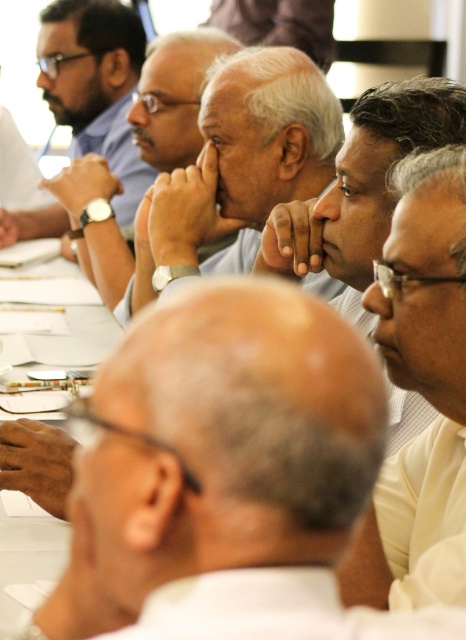
You are standing in front of the table where the meeting is taking place. You notice two points marked on the table surface at coordinates point (207, 301) and point (175, 157). Which point is closer to you?

Point (207, 301) is closer to the viewer than point (175, 157).

You are standing in front of the table where the meeting is taking place. There are two points marked on the table at coordinates point (192, 369) and point (239, 100). If you want to reach the point that is closer to you first, which coordinate should you move towards?

You should move towards point (192, 369) because it is closer to the viewer than point (239, 100).

Looking at this image, you are a photographer taking a picture of the meeting attendees. You notice the white shirt at center and the matte black shirt at upper left. Which shirt should you adjust in your camera frame to ensure both are fully visible? Explain your reasoning.

The white shirt at center has a lesser height compared to the matte black shirt at upper left. Therefore, you should adjust the matte black shirt at upper left in your camera frame since it is taller and might be partially cut off if not properly framed.